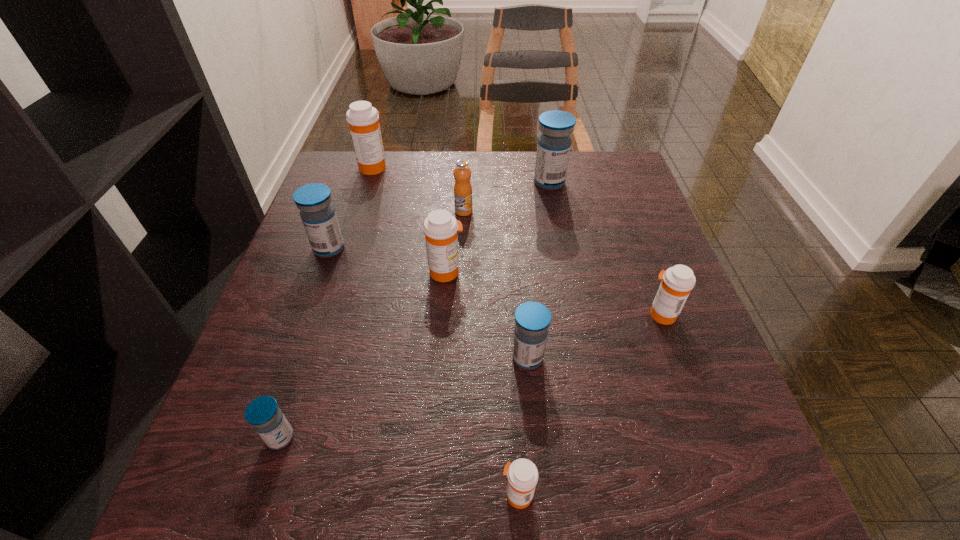
I want to click on free region at the near edge of the desktop, so click(616, 488).

Identify the location of vacant space at the left edge of the desktop. (347, 279).

Locate an element on the screen. free region at the right edge of the desktop is located at coordinates (639, 372).

Locate an element on the screen. vacant space at the far right corner of the desktop is located at coordinates pyautogui.click(x=580, y=158).

Locate an element on the screen. The height and width of the screenshot is (540, 960). blank region between the fourth farthest medicine and the third blue medicine from left to right is located at coordinates (487, 315).

What are the coordinates of `free space between the rightmost orange medicine and the seventh nearest object` in the screenshot? It's located at (563, 263).

At what (x,y) coordinates should I click in order to perform the action: click on free spot between the fourth medicine from left to right and the second object from right to left. Please return your answer as a coordinate pair (x, y). Looking at the image, I should click on (498, 227).

I want to click on free space between the fifth farthest medicine and the third orange medicine from left to right, so click(589, 404).

Find the location of `blank region between the fourth farthest object and the second orange medicine from right to left`. blank region between the fourth farthest object and the second orange medicine from right to left is located at coordinates (423, 372).

I want to click on free space between the second farthest orange medicine and the second object from right to left, so click(498, 227).